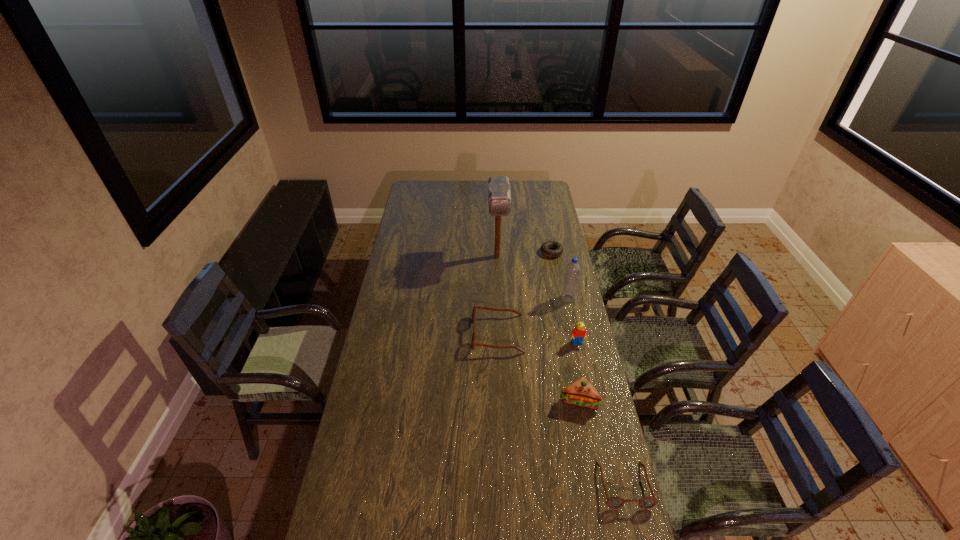
Where is `vacant space at the far left corner of the desktop`? vacant space at the far left corner of the desktop is located at coordinates (421, 197).

The height and width of the screenshot is (540, 960). Identify the location of free spot at the far right corner of the desktop. (545, 199).

Identify the location of empty location between the water bottle and the tallest object. The image size is (960, 540). (533, 278).

Locate an element on the screen. This screenshot has width=960, height=540. blank region between the shorter spectacles and the taller spectacles is located at coordinates (561, 409).

You are a GUI agent. You are given a task and a screenshot of the screen. Output one action in this format:
    pyautogui.click(x=<x>, y=<y>)
    Task: Click on the vacant area between the shortest object and the right spectacles
    The image size is (960, 540).
    Given the screenshot: What is the action you would take?
    pyautogui.click(x=588, y=369)

The width and height of the screenshot is (960, 540). I want to click on free area in between the Lego and the third shortest object, so click(538, 339).

Where is `blank region between the mallet and the Lego`? This screenshot has width=960, height=540. blank region between the mallet and the Lego is located at coordinates pos(538,300).

Where is `free space between the third farthest object and the shortest object`? This screenshot has height=540, width=960. free space between the third farthest object and the shortest object is located at coordinates (560, 275).

Where is `free space between the sixth tallest object and the farther spectacles`? Image resolution: width=960 pixels, height=540 pixels. free space between the sixth tallest object and the farther spectacles is located at coordinates (561, 409).

Where is `empty location between the Lego and the farther spectacles`? This screenshot has height=540, width=960. empty location between the Lego and the farther spectacles is located at coordinates (538, 339).